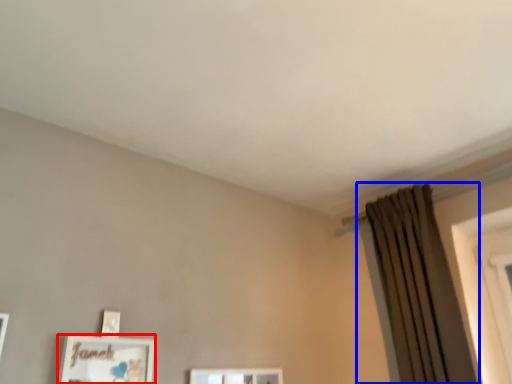
Question: Which point is closer to the camera, picture frame (highlighted by a red box) or curtain (highlighted by a blue box)?

Choices:
 (A) picture frame
 (B) curtain

Answer: (A)